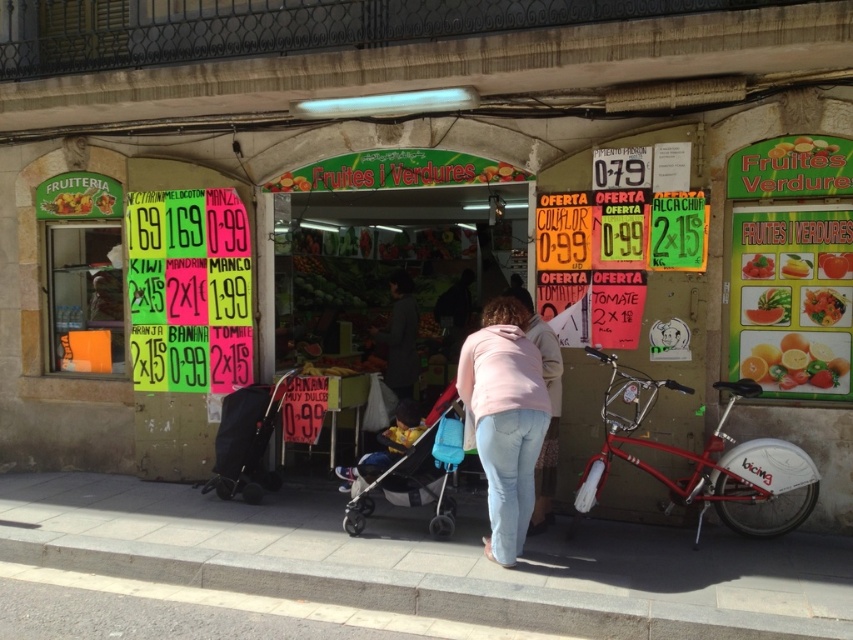
Which of these two, dark gray sweater at center or yellow smooth tomato at center, stands shorter?

With less height is yellow smooth tomato at center.

I want to click on dark gray sweater at center, so click(399, 337).

The image size is (853, 640). What do you see at coordinates (405, 422) in the screenshot?
I see `light pink fabric jacket at center` at bounding box center [405, 422].

Is light pink fabric jacket at center positioned at the back of yellow smooth tomato at center?

No, it is in front of yellow smooth tomato at center.

This screenshot has height=640, width=853. What are the coordinates of `light pink fabric jacket at center` in the screenshot? It's located at (405, 422).

Does point (409, 333) come closer to viewer compared to point (822, 294)?

No, it is behind (822, 294).

Where is `dark gray sweater at center`? The height and width of the screenshot is (640, 853). dark gray sweater at center is located at coordinates (399, 337).